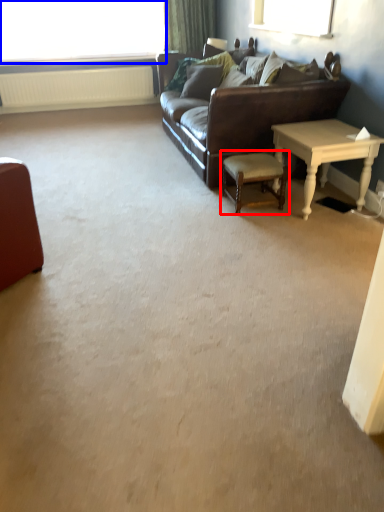
Question: Which point is closer to the camera, chair (highlighted by a red box) or window (highlighted by a blue box)?

Choices:
 (A) chair
 (B) window

Answer: (A)